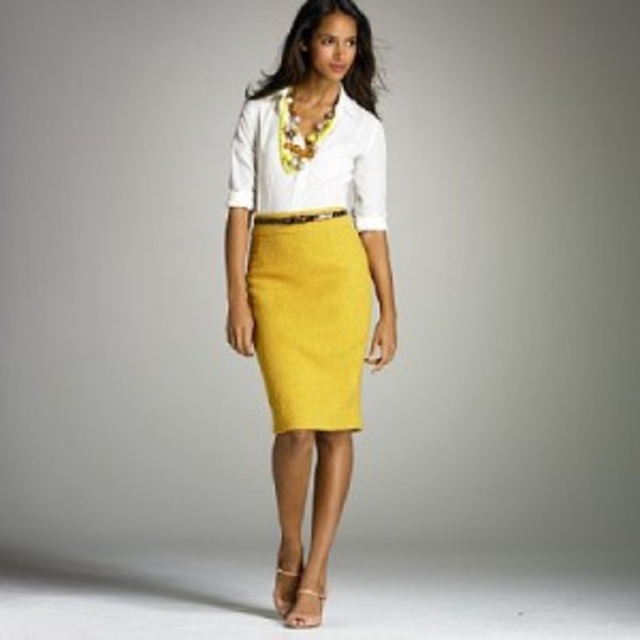
Question: In this image, where is matte yellow skirt at center located relative to matte yellow pencil skirt at center?

Choices:
 (A) right
 (B) left

Answer: (B)

Question: Which of the following is the closest to the observer?

Choices:
 (A) matte yellow pencil skirt at center
 (B) white cotton shirt at center

Answer: (A)

Question: Estimate the real-world distances between objects in this image. Which object is closer to the white cotton shirt at center?

Choices:
 (A) matte yellow pencil skirt at center
 (B) matte yellow skirt at center

Answer: (B)

Question: Is matte yellow skirt at center to the left of matte yellow pencil skirt at center from the viewer's perspective?

Choices:
 (A) no
 (B) yes

Answer: (B)

Question: Which object is the closest to the matte yellow pencil skirt at center?

Choices:
 (A) matte yellow skirt at center
 (B) white cotton shirt at center

Answer: (A)

Question: Is matte yellow pencil skirt at center further to the viewer compared to white cotton shirt at center?

Choices:
 (A) no
 (B) yes

Answer: (A)